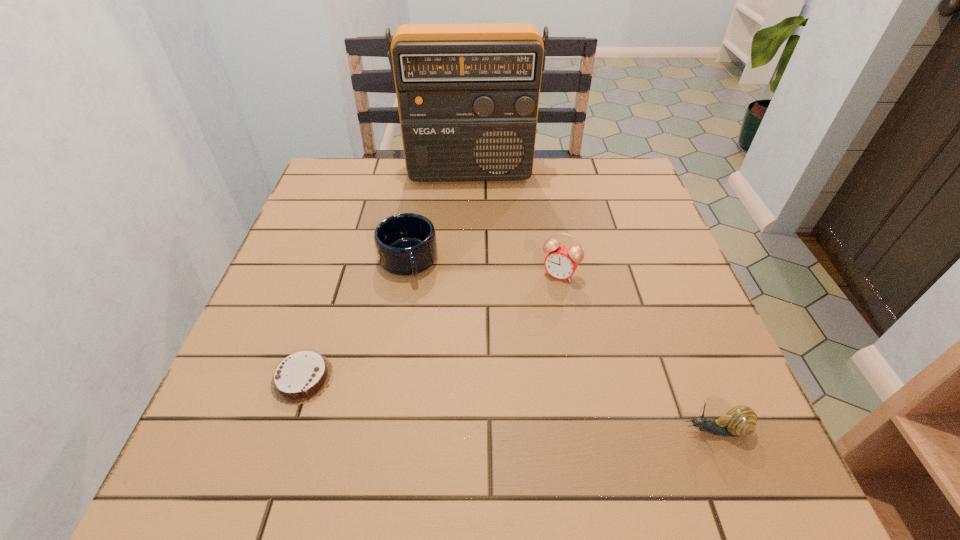
Identify the location of vacant region located 0.330m on the front-facing side of the rightmost object. (487, 430).

Identify the location of free region located on the front-facing side of the rightmost object. (457, 430).

You are a GUI agent. You are given a task and a screenshot of the screen. Output one action in this format:
    pyautogui.click(x=<x>, y=<y>)
    Task: Click on the vacant space located on the front-facing side of the radio receiver
    The width and height of the screenshot is (960, 540).
    Given the screenshot: What is the action you would take?
    pyautogui.click(x=471, y=217)

Where is `vacant space located 0.320m on the front-facing side of the radio receiver`? vacant space located 0.320m on the front-facing side of the radio receiver is located at coordinates (473, 264).

I want to click on vacant position located on the front-facing side of the radio receiver, so click(473, 273).

I want to click on vacant space located on the clock face of the second tallest object, so click(x=532, y=320).

Find the location of a particular element. Image resolution: width=960 pixels, height=540 pixels. vacant space located 0.370m on the clock face of the second tallest object is located at coordinates (475, 420).

This screenshot has width=960, height=540. I want to click on free space located 0.120m on the clock face of the second tallest object, so click(532, 320).

Identify the location of free region located 0.210m with the handle on the side of the third shortest object. This screenshot has height=540, width=960. (436, 360).

At what (x,y) coordinates should I click in order to perform the action: click on vacant space located 0.200m with the handle on the side of the third shortest object. Please return your answer as a coordinate pair (x, y). The width and height of the screenshot is (960, 540). Looking at the image, I should click on (435, 355).